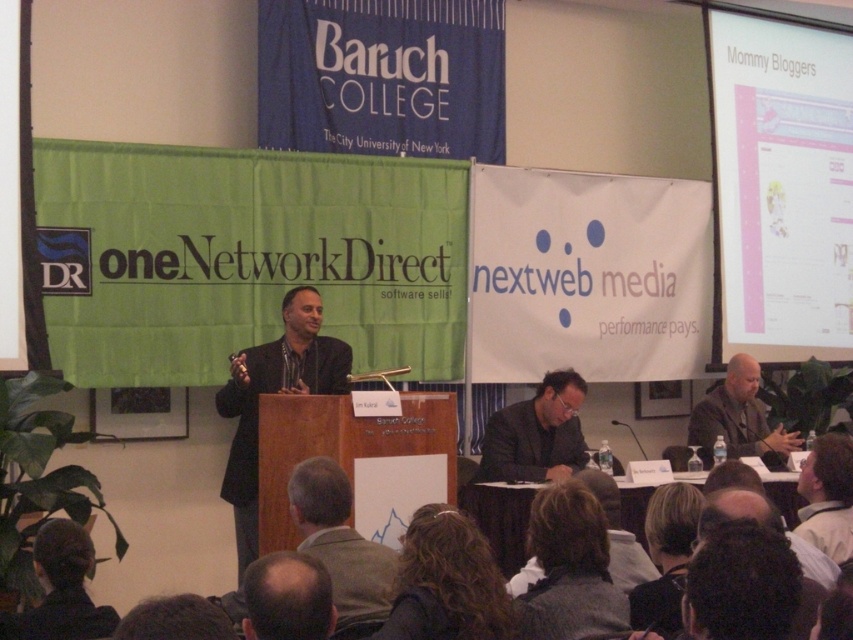
Does dark suit at center have a greater height compared to bald head at lower left?

Yes, dark suit at center is taller than bald head at lower left.

Between point (228, 408) and point (293, 618), which one is positioned in front?

Point (293, 618)

The height and width of the screenshot is (640, 853). I want to click on dark suit at center, so click(273, 392).

Can you confirm if dark gray suit at center is smaller than bald head at lower left?

Incorrect, dark gray suit at center is not smaller in size than bald head at lower left.

Can you confirm if dark gray suit at center is bigger than bald head at lower left?

Yes, dark gray suit at center is bigger than bald head at lower left.

Is point (573, 461) in front of point (258, 588)?

No, (573, 461) is further to viewer.

At what (x,y) coordinates should I click in order to perform the action: click on dark gray suit at center. Please return your answer as a coordinate pair (x, y). Looking at the image, I should click on (537, 433).

In the scene shown: Is dark curly hair at lower center closer to camera compared to bald head at lower left?

No, dark curly hair at lower center is behind bald head at lower left.

At what (x,y) coordinates should I click in order to perform the action: click on dark curly hair at lower center. Please return your answer as a coordinate pair (x, y). Looking at the image, I should click on (445, 582).

Find the location of a particular element. dark curly hair at lower center is located at coordinates (445, 582).